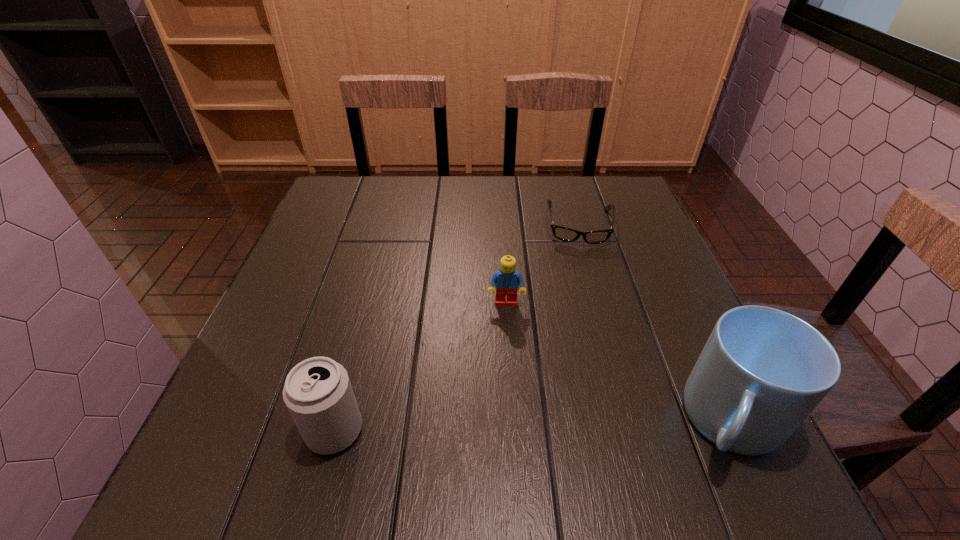
Where is `vacant space at the far right corner`? vacant space at the far right corner is located at coordinates (575, 180).

At what (x,y) coordinates should I click in order to perform the action: click on vacant space in between the leftmost object and the shortest object. Please return your answer as a coordinate pair (x, y). Image resolution: width=960 pixels, height=540 pixels. Looking at the image, I should click on (457, 328).

Locate an element on the screen. The image size is (960, 540). free spot between the tallest object and the shortest object is located at coordinates (656, 323).

Identify the location of vacant area that lies between the Lego and the second tallest object. This screenshot has height=540, width=960. (420, 367).

You are a GUI agent. You are given a task and a screenshot of the screen. Output one action in this format:
    pyautogui.click(x=<x>, y=<y>)
    Task: Click on the empty location between the third object from right to left and the farthest object
    
    Given the screenshot: What is the action you would take?
    pyautogui.click(x=542, y=264)

I want to click on free space between the tallest object and the second tallest object, so click(x=533, y=426).

The width and height of the screenshot is (960, 540). What are the coordinates of `free space between the mug and the second tallest object` in the screenshot? It's located at (533, 426).

At what (x,y) coordinates should I click in order to perform the action: click on free space between the second object from left to right and the spectacles. Please return your answer as a coordinate pair (x, y). Looking at the image, I should click on (542, 264).

The height and width of the screenshot is (540, 960). What are the coordinates of `free space between the tallest object and the farthest object` in the screenshot? It's located at (656, 323).

At what (x,y) coordinates should I click in order to perform the action: click on free space between the mug and the can. Please return your answer as a coordinate pair (x, y). The image size is (960, 540). Looking at the image, I should click on (533, 426).